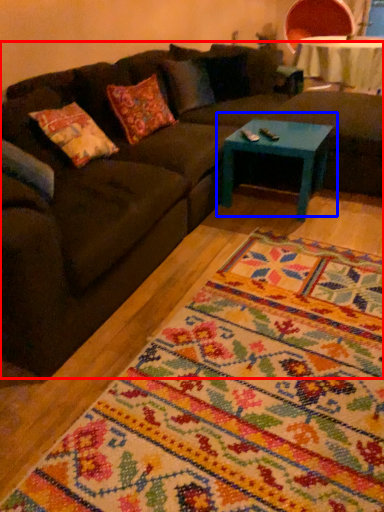
Question: Which object appears closest to the camera in this image, studio couch (highlighted by a red box) or coffee table (highlighted by a blue box)?

Choices:
 (A) studio couch
 (B) coffee table

Answer: (A)